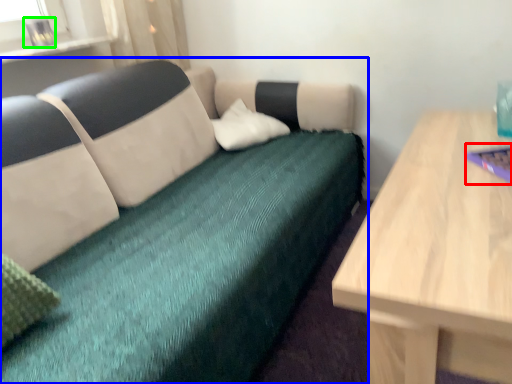
Question: Considering the real-world distances, which object is farthest from laptop (highlighted by a red box)? studio couch (highlighted by a blue box) or glass vase (highlighted by a green box)?

Choices:
 (A) studio couch
 (B) glass vase

Answer: (B)